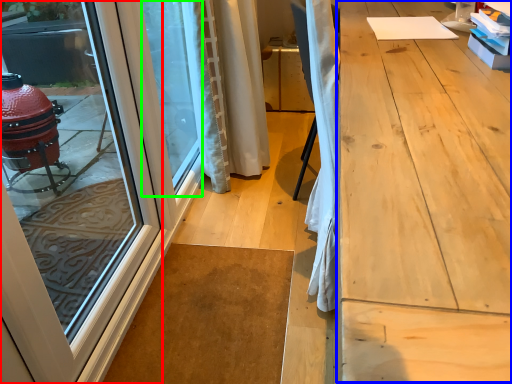
Question: Estimate the real-world distances between objects in this image. Which object is farther from door (highlighted by a red box), workbench (highlighted by a blue box) or window screen (highlighted by a green box)?

Choices:
 (A) workbench
 (B) window screen

Answer: (A)